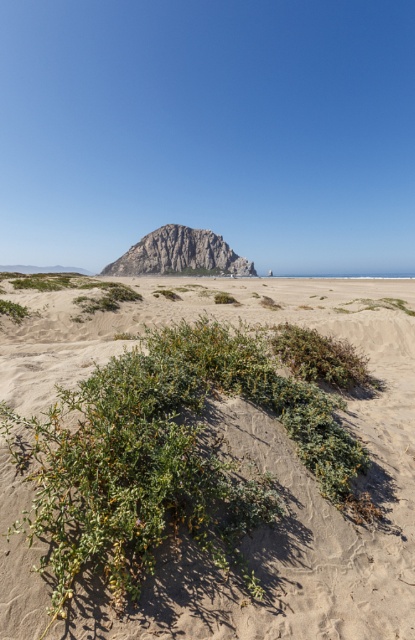
You are standing on the beach and want to take a photo of the rugged gray rock at center without any green shrubbery at center in the foreground. Which direction should you move to achieve this?

The green shrubbery at center is below the rugged gray rock at center. To avoid having the shrubbery in the foreground, you should move to a position where the rugged gray rock at center is elevated above the green shrubbery at center. This can be achieved by moving either to the left or right of the current position, positioning yourself so that the rock is higher in the frame and the shrubbery is out of the shot.

You are standing on the beach and want to take a photo of both the green shrubbery at center and the rugged gray rock at center. Which object should you position to your left to include both in the frame?

You should position the rugged gray rock at center to your left since the green shrubbery at center is to the right of it, ensuring both are in the frame.